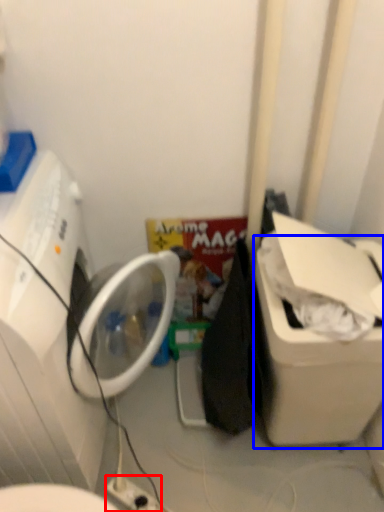
Question: Among these objects, which one is farthest to the camera, electric outlet (highlighted by a red box) or water cooler (highlighted by a blue box)?

Choices:
 (A) electric outlet
 (B) water cooler

Answer: (A)